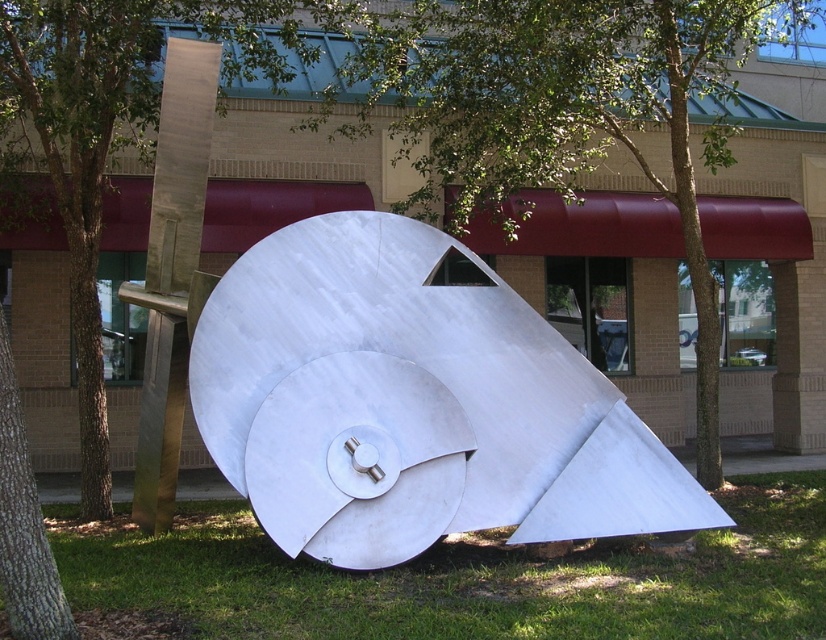
Question: Among these objects, which one is farthest from the camera?

Choices:
 (A) green grass at lower center
 (B) metallic silver sculpture at center
 (C) green leafy tree at center

Answer: (C)

Question: Can you confirm if metallic silver sculpture at center is positioned to the left of green grass at lower center?

Choices:
 (A) no
 (B) yes

Answer: (B)

Question: Does metallic silver sculpture at center have a greater width compared to green leafy tree at center?

Choices:
 (A) no
 (B) yes

Answer: (B)

Question: Is green grass at lower center bigger than green leafy tree at center?

Choices:
 (A) yes
 (B) no

Answer: (A)

Question: Estimate the real-world distances between objects in this image. Which object is closer to the green leafy tree at center?

Choices:
 (A) metallic silver sculpture at center
 (B) green grass at lower center

Answer: (A)

Question: Which of these objects is positioned farthest from the metallic silver sculpture at center?

Choices:
 (A) green grass at lower center
 (B) green leafy tree at center

Answer: (B)